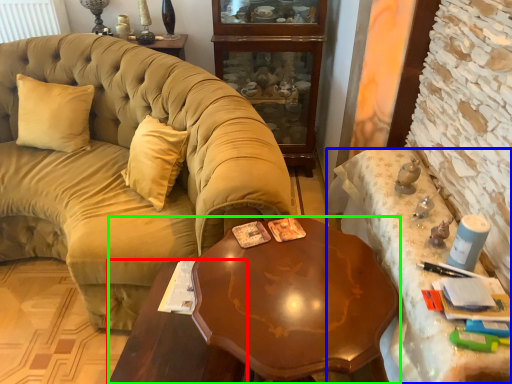
Question: Which object is the closest to the table (highlighted by a red box)? Choose among these: desk (highlighted by a blue box) or desk (highlighted by a green box).

Choices:
 (A) desk
 (B) desk

Answer: (B)